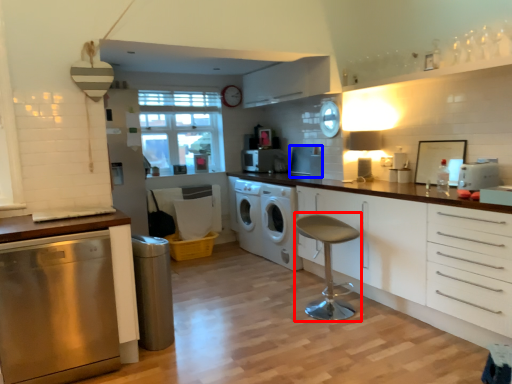
Question: Among these objects, which one is farthest to the camera, bar stool (highlighted by a red box) or appliance (highlighted by a blue box)?

Choices:
 (A) bar stool
 (B) appliance

Answer: (B)